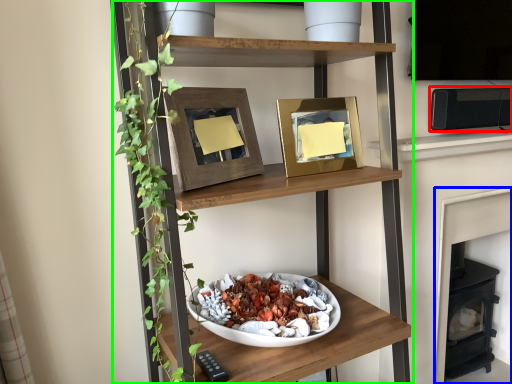
Question: Considering the real-world distances, which object is farthest from appliance (highlighted by a red box)? fireplace (highlighted by a blue box) or shelf (highlighted by a green box)?

Choices:
 (A) fireplace
 (B) shelf

Answer: (B)